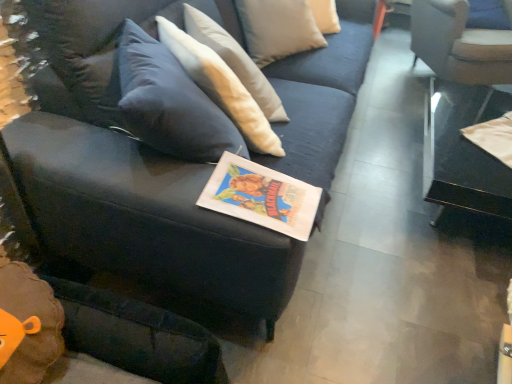
Question: Would you say velvet dark blue couch at center is inside or outside white fabric chair at upper right?

Choices:
 (A) inside
 (B) outside

Answer: (B)

Question: From a real-world perspective, is velvet dark blue couch at center physically located above or below white fabric chair at upper right?

Choices:
 (A) below
 (B) above

Answer: (B)

Question: Which object is positioned closest to the transparent glass table at right?

Choices:
 (A) white fabric chair at upper right
 (B) velvet dark blue couch at center
 (C) matte paper book at center

Answer: (A)

Question: Which is farther from the matte paper book at center?

Choices:
 (A) velvet dark blue couch at center
 (B) white fabric chair at upper right
 (C) transparent glass table at right

Answer: (B)